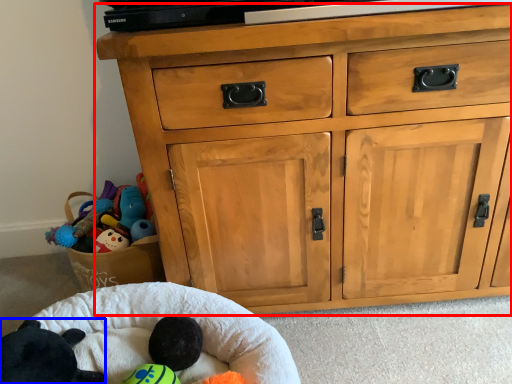
Question: Among these objects, which one is nearest to the camera, chest of drawers (highlighted by a red box) or animal (highlighted by a blue box)?

Choices:
 (A) chest of drawers
 (B) animal

Answer: (B)